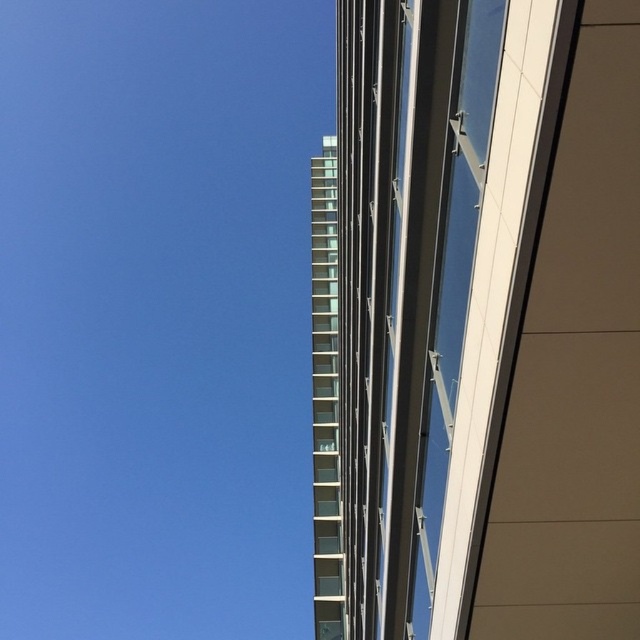
You are a GUI agent. You are given a task and a screenshot of the screen. Output one action in this format:
    pyautogui.click(x=<x>, y=<y>)
    Task: Click on the transparent glass tower at upper center
    The height and width of the screenshot is (640, 640).
    Given the screenshot: What is the action you would take?
    pyautogui.click(x=481, y=323)

Between transparent glass tower at upper center and clear glass windows at center, which one has more height?

clear glass windows at center is taller.

The width and height of the screenshot is (640, 640). Identify the location of transparent glass tower at upper center. (481, 323).

The image size is (640, 640). What are the coordinates of `transparent glass tower at upper center` in the screenshot? It's located at (481, 323).